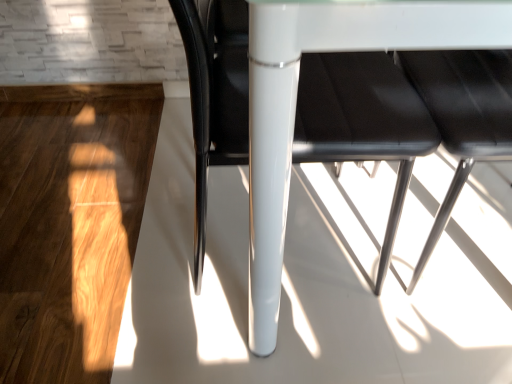
This screenshot has height=384, width=512. Identify the location of white glossy table at center. (337, 50).

Describe the element at coordinates (337, 50) in the screenshot. The width and height of the screenshot is (512, 384). I see `white glossy table at center` at that location.

What is the approximate width of white glossy table at center?

The width of white glossy table at center is 1.12 meters.

Locate an element on the screen. The image size is (512, 384). glossy black chair at center is located at coordinates (362, 119).

Image resolution: width=512 pixels, height=384 pixels. What do you see at coordinates (362, 119) in the screenshot? I see `glossy black chair at center` at bounding box center [362, 119].

Measure the distance between point (202, 255) and camera.

Point (202, 255) is 3.67 feet from camera.

Where is `white glossy table at center`? white glossy table at center is located at coordinates (337, 50).

Considering the positions of objects glossy black chair at center and white glossy table at center in the image provided, who is more to the left, glossy black chair at center or white glossy table at center?

glossy black chair at center is more to the left.

Is the depth of glossy black chair at center less than that of white glossy table at center?

No, it is not.

Considering the positions of points (202, 171) and (252, 241), is point (202, 171) farther from camera compared to point (252, 241)?

Yes, point (202, 171) is behind point (252, 241).

From the image's perspective, is glossy black chair at center on white glossy table at center?

No, from the image's perspective, glossy black chair at center is not over white glossy table at center.

Consider the image. From a real-world perspective, is glossy black chair at center under white glossy table at center?

Yes, from a real-world perspective, glossy black chair at center is below white glossy table at center.

Considering the sizes of objects glossy black chair at center and white glossy table at center in the image provided, who is wider, glossy black chair at center or white glossy table at center?

With larger width is white glossy table at center.

Can you confirm if glossy black chair at center is taller than white glossy table at center?

No.

Considering the relative sizes of glossy black chair at center and white glossy table at center in the image provided, is glossy black chair at center bigger than white glossy table at center?

No, glossy black chair at center is not bigger than white glossy table at center.

Which is correct: glossy black chair at center is inside white glossy table at center, or outside of it?

glossy black chair at center is spatially positioned inside white glossy table at center.

Can you see glossy black chair at center touching white glossy table at center?

No, glossy black chair at center is not beside white glossy table at center.

Could you tell me if glossy black chair at center is facing white glossy table at center?

Yes.

Where is `table in front of the glossy black chair at center`? The height and width of the screenshot is (384, 512). table in front of the glossy black chair at center is located at coordinates (337, 50).

Which is more to the right, white glossy table at center or glossy black chair at center?

Positioned to the right is white glossy table at center.

Is white glossy table at center positioned in front of glossy black chair at center?

That is True.

Which is closer to the camera, (265, 255) or (309, 122)?

The point (265, 255) is in front.

From the image's perspective, is white glossy table at center on glossy black chair at center?

Correct, white glossy table at center appears higher than glossy black chair at center in the image.

From a real-world perspective, is white glossy table at center physically located above or below glossy black chair at center?

white glossy table at center is above glossy black chair at center.

Looking at their sizes, would you say white glossy table at center is wider or thinner than glossy black chair at center?

Considering their sizes, white glossy table at center looks broader than glossy black chair at center.

Is white glossy table at center taller than glossy black chair at center?

Indeed, white glossy table at center has a greater height compared to glossy black chair at center.

Is white glossy table at center bigger than glossy black chair at center?

Correct, white glossy table at center is larger in size than glossy black chair at center.

Is white glossy table at center not inside glossy black chair at center?

Indeed, white glossy table at center is completely outside glossy black chair at center.

From the picture: Are white glossy table at center and glossy black chair at center beside each other?

No, white glossy table at center is not making contact with glossy black chair at center.

Is white glossy table at center oriented towards glossy black chair at center?

Yes.

How different are the orientations of white glossy table at center and glossy black chair at center in degrees?

They differ by 91.9 degrees in their facing directions.

Where is `chair that appears below the white glossy table at center (from the image's perspective)`? This screenshot has width=512, height=384. chair that appears below the white glossy table at center (from the image's perspective) is located at coordinates (362, 119).

Locate an element on the screen. table in front of the glossy black chair at center is located at coordinates pyautogui.click(x=337, y=50).

This screenshot has height=384, width=512. What are the coordinates of `table on the right side of glossy black chair at center` in the screenshot? It's located at (337, 50).